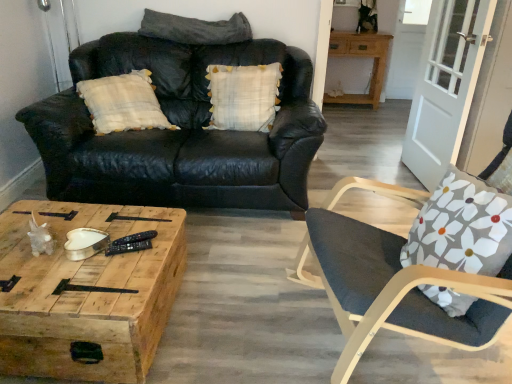
The height and width of the screenshot is (384, 512). Find the location of `black leather couch at upper left`. black leather couch at upper left is located at coordinates [179, 131].

What do you see at coordinates (88, 294) in the screenshot? The image size is (512, 384). I see `woodenwoodencoffee table at lower left` at bounding box center [88, 294].

The width and height of the screenshot is (512, 384). I want to click on wooden table at upper right, so tap(361, 56).

Locate an element on the screen. This screenshot has height=384, width=512. gray fabric pillow at upper center, the first pillow viewed from the top is located at coordinates (195, 29).

You are a GUI agent. You are given a task and a screenshot of the screen. Output one action in this format:
    pyautogui.click(x=<x>, y=<y>)
    Task: Click on the white plaid pillow at center, marked as the first pillow in a bottom-to-top arrangement
    This screenshot has height=384, width=512.
    Given the screenshot: What is the action you would take?
    243,96

From their relative heights in the image, would you say woodenwoodencoffee table at lower left is taller or shorter than black leather couch at upper left?

Clearly, woodenwoodencoffee table at lower left is shorter compared to black leather couch at upper left.

Looking at this image, is black leather couch at upper left completely or partially inside woodenwoodencoffee table at lower left?

No, black leather couch at upper left is not a part of woodenwoodencoffee table at lower left.

Are woodenwoodencoffee table at lower left and black leather couch at upper left making contact?

No, woodenwoodencoffee table at lower left is not in contact with black leather couch at upper left.

From a real-world perspective, which object rests below the other?

woodenwoodencoffee table at lower left is physically lower.

From the picture: Considering the relative sizes of white plaid pillow at center, marked as the first pillow in a bottom-to-top arrangement, and woodenwoodencoffee table at lower left in the image provided, is white plaid pillow at center, marked as the first pillow in a bottom-to-top arrangement, thinner than woodenwoodencoffee table at lower left?

Indeed, white plaid pillow at center, marked as the first pillow in a bottom-to-top arrangement, has a lesser width compared to woodenwoodencoffee table at lower left.

Where is `coffee table in front of the white plaid pillow at center, marked as the first pillow in a bottom-to-top arrangement`? The width and height of the screenshot is (512, 384). coffee table in front of the white plaid pillow at center, marked as the first pillow in a bottom-to-top arrangement is located at coordinates (88, 294).

Is the position of white plaid pillow at center, marked as the first pillow in a bottom-to-top arrangement, more distant than that of woodenwoodencoffee table at lower left?

Yes, white plaid pillow at center, marked as the first pillow in a bottom-to-top arrangement, is further from the viewer.

Does black leather couch at upper left have a smaller size compared to floral fabric cushion at right?

No, black leather couch at upper left is not smaller than floral fabric cushion at right.

Is floral fabric cushion at right completely or partially inside black leather couch at upper left?

Definitely not — floral fabric cushion at right is not inside black leather couch at upper left.

Can you confirm if white plaid pillow at center, marked as the first pillow in a bottom-to-top arrangement, is positioned to the right of gray fabric pillow at upper center, the first pillow viewed from the top?

Correct, you'll find white plaid pillow at center, marked as the first pillow in a bottom-to-top arrangement, to the right of gray fabric pillow at upper center, the first pillow viewed from the top.

Which is farther from the camera, (x=220, y=111) or (x=144, y=29)?

The point (x=144, y=29) is more distant.

How different are the orientations of white plaid pillow at center, which ranks as the 2th pillow in top-to-bottom order, and gray fabric pillow at upper center, the first pillow viewed from the top, in degrees?

The angular difference between white plaid pillow at center, which ranks as the 2th pillow in top-to-bottom order, and gray fabric pillow at upper center, the first pillow viewed from the top, is 6.77 degrees.

Based on the photo, considering the positions of objects white plaid pillow at center, marked as the first pillow in a bottom-to-top arrangement, and gray fabric pillow at upper center, positioned as the second pillow in bottom-to-top order, in the image provided, who is behind, white plaid pillow at center, marked as the first pillow in a bottom-to-top arrangement, or gray fabric pillow at upper center, positioned as the second pillow in bottom-to-top order,?

gray fabric pillow at upper center, positioned as the second pillow in bottom-to-top order, is further away from the camera.

Is white plaid pillow at center, which ranks as the 2th pillow in top-to-bottom order, spatially inside wooden table at upper right, or outside of it?

white plaid pillow at center, which ranks as the 2th pillow in top-to-bottom order, is spatially situated outside wooden table at upper right.

Considering the relative sizes of white plaid pillow at center, which ranks as the 2th pillow in top-to-bottom order, and wooden table at upper right in the image provided, is white plaid pillow at center, which ranks as the 2th pillow in top-to-bottom order, smaller than wooden table at upper right?

Yes, white plaid pillow at center, which ranks as the 2th pillow in top-to-bottom order, is smaller than wooden table at upper right.

From a real-world perspective, is white plaid pillow at center, marked as the first pillow in a bottom-to-top arrangement, on wooden table at upper right?

Yes, from a real-world perspective, white plaid pillow at center, marked as the first pillow in a bottom-to-top arrangement, is above wooden table at upper right.

Are white plaid pillow at center, which ranks as the 2th pillow in top-to-bottom order, and wooden table at upper right located far from each other?

Yes, white plaid pillow at center, which ranks as the 2th pillow in top-to-bottom order, and wooden table at upper right are quite far apart.

From a real-world perspective, who is located lower, gray fabric pillow at upper center, the first pillow viewed from the top, or white plaid pillow at center, marked as the first pillow in a bottom-to-top arrangement?

white plaid pillow at center, marked as the first pillow in a bottom-to-top arrangement, is physically lower.

From the image's perspective, who appears lower, gray fabric pillow at upper center, positioned as the second pillow in bottom-to-top order, or white plaid pillow at center, marked as the first pillow in a bottom-to-top arrangement?

white plaid pillow at center, marked as the first pillow in a bottom-to-top arrangement.

Who is bigger, gray fabric pillow at upper center, the first pillow viewed from the top, or white plaid pillow at center, marked as the first pillow in a bottom-to-top arrangement?

With larger size is white plaid pillow at center, marked as the first pillow in a bottom-to-top arrangement.

Does gray fabric pillow at upper center, the first pillow viewed from the top, have a lesser width compared to white plaid pillow at center, marked as the first pillow in a bottom-to-top arrangement?

No.

Is white wood screen door at right not close to wooden table at upper right?

Yes.

Considering the sizes of white wood screen door at right and wooden table at upper right in the image, is white wood screen door at right bigger or smaller than wooden table at upper right?

Clearly, white wood screen door at right is smaller in size than wooden table at upper right.

Is white wood screen door at right located outside wooden table at upper right?

Yes, white wood screen door at right is located beyond the bounds of wooden table at upper right.

At what (x,y) coordinates should I click in order to perform the action: click on studio couch above the woodenwoodencoffee table at lower left (from the image's perspective). Please return your answer as a coordinate pair (x, y). This screenshot has width=512, height=384. Looking at the image, I should click on (179, 131).

Where is `the 2nd pillow counting from the right of the woodenwoodencoffee table at lower left`? Image resolution: width=512 pixels, height=384 pixels. the 2nd pillow counting from the right of the woodenwoodencoffee table at lower left is located at coordinates (243, 96).

Estimate the real-world distances between objects in this image. Which object is closer to gray fabric pillow at upper center, positioned as the second pillow in bottom-to-top order, dark gray fabric chair at right or black leather couch at upper left?

black leather couch at upper left is positioned closer to the anchor gray fabric pillow at upper center, positioned as the second pillow in bottom-to-top order.

When comparing their distances from gray fabric pillow at upper center, the first pillow viewed from the top, does white wood screen door at right or white plaid pillow at center, marked as the first pillow in a bottom-to-top arrangement, seem closer?

Among the two, white plaid pillow at center, marked as the first pillow in a bottom-to-top arrangement, is located nearer to gray fabric pillow at upper center, the first pillow viewed from the top.

When comparing their distances from floral fabric cushion at right, does black leather couch at upper left or white wood screen door at right seem further?

white wood screen door at right.

From the image, which object appears to be nearer to wooden table at upper right, white plaid pillow at center, which ranks as the 2th pillow in top-to-bottom order, or dark gray fabric chair at right?

white plaid pillow at center, which ranks as the 2th pillow in top-to-bottom order, is closer to wooden table at upper right.

From the image, which object appears to be nearer to white plaid pillow at center, which ranks as the 2th pillow in top-to-bottom order, dark gray fabric chair at right or floral fabric cushion at right?

dark gray fabric chair at right lies closer to white plaid pillow at center, which ranks as the 2th pillow in top-to-bottom order, than the other object.

Looking at the image, which one is located closer to dark gray fabric chair at right, white wood screen door at right or floral fabric cushion at right?

Based on the image, floral fabric cushion at right appears to be nearer to dark gray fabric chair at right.

When comparing their distances from woodenwoodencoffee table at lower left, does dark gray fabric chair at right or gray fabric pillow at upper center, the first pillow viewed from the top, seem closer?

dark gray fabric chair at right is positioned closer to the anchor woodenwoodencoffee table at lower left.

Estimate the real-world distances between objects in this image. Which object is further from floral fabric cushion at right, black leather couch at upper left or wooden table at upper right?

The object further to floral fabric cushion at right is wooden table at upper right.

Identify the location of screen door between woodenwoodencoffee table at lower left and wooden table at upper right in the front-back direction. The image size is (512, 384). (445, 85).

Where is `pillow between gray fabric pillow at upper center, positioned as the second pillow in bottom-to-top order, and woodenwoodencoffee table at lower left in the up-down direction`? pillow between gray fabric pillow at upper center, positioned as the second pillow in bottom-to-top order, and woodenwoodencoffee table at lower left in the up-down direction is located at coordinates (243, 96).

Where is `chair between woodenwoodencoffee table at lower left and floral fabric cushion at right from left to right`? Image resolution: width=512 pixels, height=384 pixels. chair between woodenwoodencoffee table at lower left and floral fabric cushion at right from left to right is located at coordinates (391, 282).

The width and height of the screenshot is (512, 384). I want to click on studio couch between woodenwoodencoffee table at lower left and white plaid pillow at center, marked as the first pillow in a bottom-to-top arrangement, from front to back, so click(179, 131).